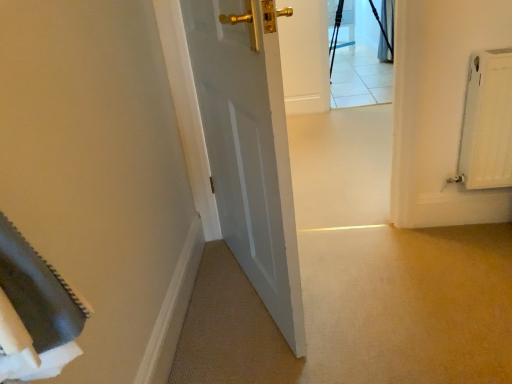
Describe the element at coordinates (386, 31) in the screenshot. I see `black fabric curtain at upper right` at that location.

You are a GUI agent. You are given a task and a screenshot of the screen. Output one action in this format:
    pyautogui.click(x=<x>, y=<y>)
    Task: Click on the black fabric curtain at upper right
    The image size is (512, 384).
    Given the screenshot: What is the action you would take?
    pyautogui.click(x=386, y=31)

This screenshot has width=512, height=384. What do you see at coordinates (341, 21) in the screenshot? I see `matte black chair at upper center` at bounding box center [341, 21].

Identify the location of matte black chair at upper center. The image size is (512, 384). point(341,21).

Where is `black fabric curtain at upper right`? The image size is (512, 384). black fabric curtain at upper right is located at coordinates (386, 31).

Considering the positions of objects black fabric curtain at upper right and matte black chair at upper center in the image provided, who is more to the right, black fabric curtain at upper right or matte black chair at upper center?

black fabric curtain at upper right.

Is the depth of black fabric curtain at upper right greater than that of matte black chair at upper center?

No, it is not.

Which point is more distant from viewer, (382, 28) or (343, 40)?

Positioned behind is point (343, 40).

From the image's perspective, does black fabric curtain at upper right appear lower than matte black chair at upper center?

Yes, from the image's perspective, black fabric curtain at upper right is beneath matte black chair at upper center.

From a real-world perspective, is black fabric curtain at upper right physically located above or below matte black chair at upper center?

black fabric curtain at upper right is below matte black chair at upper center.

Does black fabric curtain at upper right have a greater width compared to matte black chair at upper center?

In fact, black fabric curtain at upper right might be narrower than matte black chair at upper center.

Considering the sizes of objects black fabric curtain at upper right and matte black chair at upper center in the image provided, who is shorter, black fabric curtain at upper right or matte black chair at upper center?

matte black chair at upper center.

Can you confirm if black fabric curtain at upper right is bigger than matte black chair at upper center?

Actually, black fabric curtain at upper right might be smaller than matte black chair at upper center.

Is black fabric curtain at upper right inside or outside of matte black chair at upper center?

The correct answer is: outside.

Are black fabric curtain at upper right and matte black chair at upper center located far from each other?

black fabric curtain at upper right is far away from matte black chair at upper center.

Is black fabric curtain at upper right oriented towards matte black chair at upper center?

Yes.

Based on the photo, can you tell me how much black fabric curtain at upper right and matte black chair at upper center differ in facing direction?

There is a 91.7-degree angle between the facing directions of black fabric curtain at upper right and matte black chair at upper center.

This screenshot has width=512, height=384. I want to click on chair on the left of black fabric curtain at upper right, so click(x=341, y=21).

Consider the image. Does matte black chair at upper center appear on the right side of black fabric curtain at upper right?

In fact, matte black chair at upper center is to the left of black fabric curtain at upper right.

Considering the positions of objects matte black chair at upper center and black fabric curtain at upper right in the image provided, who is in front, matte black chair at upper center or black fabric curtain at upper right?

black fabric curtain at upper right.

Considering the positions of point (346, 10) and point (390, 18), is point (346, 10) closer or farther from the camera than point (390, 18)?

Point (346, 10) appears to be farther away from the viewer than point (390, 18).

From the image's perspective, is matte black chair at upper center above black fabric curtain at upper right?

Yes, from the image's perspective, matte black chair at upper center is over black fabric curtain at upper right.

From a real-world perspective, is matte black chair at upper center located beneath black fabric curtain at upper right?

No, from a real-world perspective, matte black chair at upper center is not below black fabric curtain at upper right.

Is matte black chair at upper center wider than black fabric curtain at upper right?

Indeed, matte black chair at upper center has a greater width compared to black fabric curtain at upper right.

Can you confirm if matte black chair at upper center is taller than black fabric curtain at upper right?

Incorrect, the height of matte black chair at upper center is not larger of that of black fabric curtain at upper right.

Looking at the image, does matte black chair at upper center seem bigger or smaller compared to black fabric curtain at upper right?

Clearly, matte black chair at upper center is larger in size than black fabric curtain at upper right.

From the picture: Would you say matte black chair at upper center contains black fabric curtain at upper right?

No, black fabric curtain at upper right is not inside matte black chair at upper center.

From the picture: Is matte black chair at upper center far away from black fabric curtain at upper right?

Indeed, matte black chair at upper center is not near black fabric curtain at upper right.

Is matte black chair at upper center oriented away from black fabric curtain at upper right?

matte black chair at upper center is not turned away from black fabric curtain at upper right.

Can you tell me how much matte black chair at upper center and black fabric curtain at upper right differ in facing direction?

The facing directions of matte black chair at upper center and black fabric curtain at upper right are 91.7 degrees apart.

From the picture: How much distance is there between matte black chair at upper center and black fabric curtain at upper right?

matte black chair at upper center is 4.26 feet away from black fabric curtain at upper right.

You are a GUI agent. You are given a task and a screenshot of the screen. Output one action in this format:
    pyautogui.click(x=<x>, y=<y>)
    Task: Click on the curtain below the matte black chair at upper center (from the image's perspective)
    
    Given the screenshot: What is the action you would take?
    pyautogui.click(x=386, y=31)

Where is `curtain in front of the matte black chair at upper center`? The width and height of the screenshot is (512, 384). curtain in front of the matte black chair at upper center is located at coordinates tap(386, 31).

Image resolution: width=512 pixels, height=384 pixels. I want to click on chair to the left of black fabric curtain at upper right, so click(x=341, y=21).